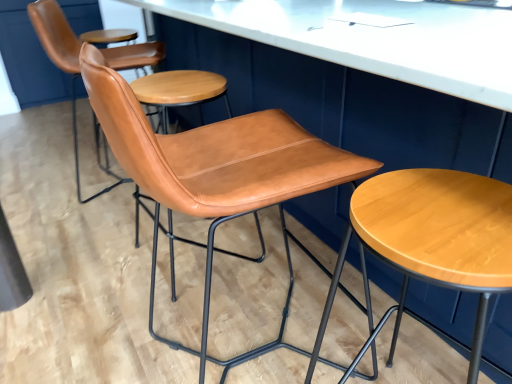
Question: Does point (74, 107) appear closer or farther from the camera than point (206, 87)?

Choices:
 (A) farther
 (B) closer

Answer: (A)

Question: Visually, is cognac leather chair at center, marked as the 3th chair in a front-to-back arrangement, positioned to the left or to the right of cognac leather chair at center, the second chair viewed from the front?

Choices:
 (A) right
 (B) left

Answer: (B)

Question: Considering the real-world distances, which object is closest to the cognac leather chair at center, which is counted as the 3th chair, starting from the back?

Choices:
 (A) cognac leather chair at center, marked as the 1th chair in a back-to-front arrangement
 (B) light brown wood stool at center
 (C) cognac leather chair at center, the second chair viewed from the front

Answer: (B)

Question: Which object is positioned closest to the cognac leather chair at center, marked as the 3th chair in a front-to-back arrangement?

Choices:
 (A) cognac leather chair at center, which is counted as the 3th chair, starting from the back
 (B) cognac leather chair at center, the second chair viewed from the front
 (C) light brown wood stool at center

Answer: (B)